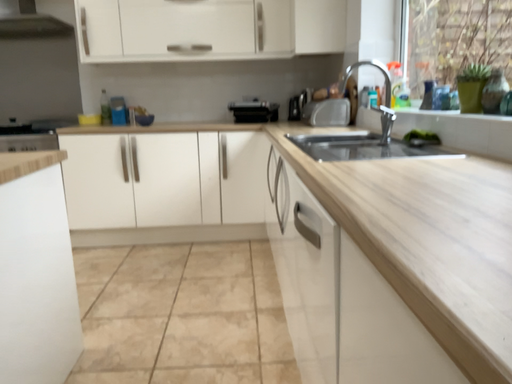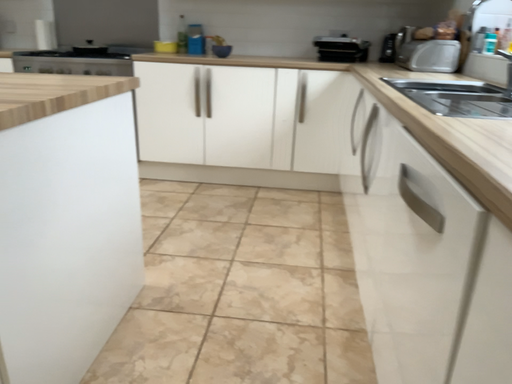
Question: Which way did the camera rotate in the video?

Choices:
 (A) rotated downward
 (B) rotated upward

Answer: (A)